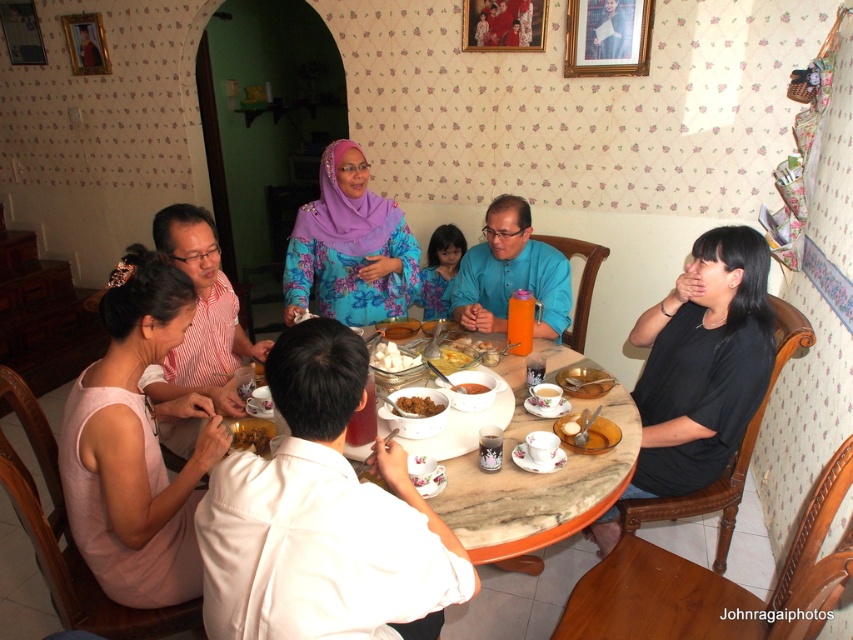
Between pink fabric dress at lower left and blue satin blouse at center, which one has more height?

pink fabric dress at lower left is taller.

Which of these two, pink fabric dress at lower left or blue satin blouse at center, stands shorter?

blue satin blouse at center

I want to click on pink fabric dress at lower left, so click(x=135, y=444).

Is the position of floral fabric hijab at center less distant than that of smooth brown rice at center?

No, it is not.

Based on the photo, does floral fabric hijab at center have a lesser width compared to smooth brown rice at center?

Incorrect, floral fabric hijab at center's width is not less than smooth brown rice at center's.

Is point (318, 186) more distant than point (465, 388)?

Yes, it is behind point (465, 388).

Where is `floral fabric hijab at center`? The height and width of the screenshot is (640, 853). floral fabric hijab at center is located at coordinates (349, 246).

Locate an element on the screen. This screenshot has height=640, width=853. blue satin blouse at center is located at coordinates (440, 269).

Which of these two, blue satin blouse at center or smooth white rice bowl at center, stands shorter?

smooth white rice bowl at center is shorter.

Who is more forward, [448,241] or [404,323]?

Point [404,323] is more forward.

Find the location of `blue satin blouse at center`. blue satin blouse at center is located at coordinates (x=440, y=269).